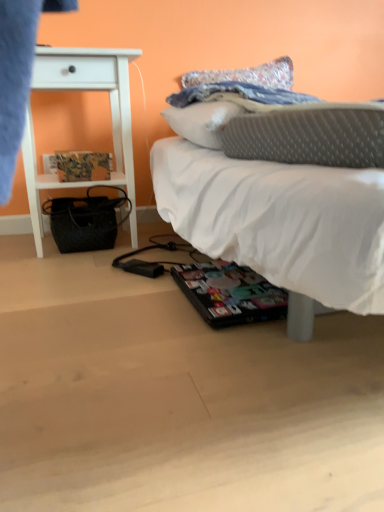
Question: In terms of size, does white wood nightstand at left appear bigger or smaller than printed paper magazine at left?

Choices:
 (A) small
 (B) big

Answer: (B)

Question: From the image's perspective, relative to printed paper magazine at left, is white wood nightstand at left above or below?

Choices:
 (A) below
 (B) above

Answer: (B)

Question: Which of these objects is positioned farthest from the white soft bed at center?

Choices:
 (A) printed paper magazine at left
 (B) white wood nightstand at left

Answer: (A)

Question: Which is nearer to the white soft bed at center?

Choices:
 (A) white wood nightstand at left
 (B) printed paper magazine at left

Answer: (A)